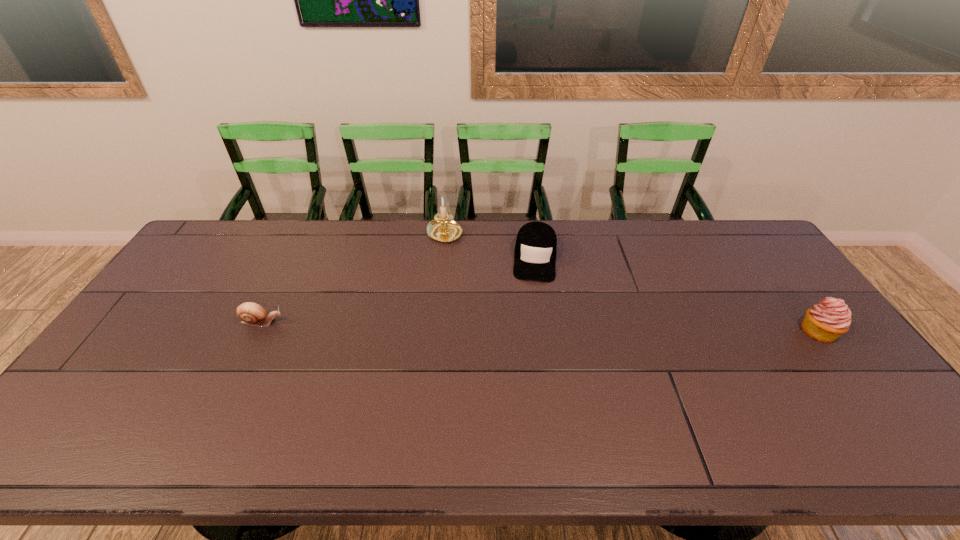
Find the location of a particular element. This screenshot has width=960, height=540. vacant region located on the front-facing side of the second shortest object is located at coordinates (531, 343).

Identify the location of free space located on the front-facing side of the second shortest object. This screenshot has width=960, height=540. (534, 298).

Image resolution: width=960 pixels, height=540 pixels. In order to click on blank space located 0.340m on the front-facing side of the second shortest object in this screenshot , I will do `click(529, 369)`.

This screenshot has height=540, width=960. I want to click on vacant space located 0.380m on the handle side of the third object from right to left, so click(x=500, y=320).

Locate an element on the screen. Image resolution: width=960 pixels, height=540 pixels. vacant space situated on the handle side of the third object from right to left is located at coordinates (464, 265).

You are a GUI agent. You are given a task and a screenshot of the screen. Output one action in this format:
    pyautogui.click(x=<x>, y=<y>)
    Task: Click on the vacant region located on the handle side of the third object from right to left
    
    Given the screenshot: What is the action you would take?
    pyautogui.click(x=500, y=320)

Locate an element on the screen. The width and height of the screenshot is (960, 540). cap that is at the far edge is located at coordinates (535, 251).

In order to click on candle holder present at the far edge in this screenshot , I will do `click(443, 228)`.

The height and width of the screenshot is (540, 960). I want to click on object that is at the right edge, so click(x=826, y=321).

The image size is (960, 540). I want to click on free space at the far edge, so click(507, 228).